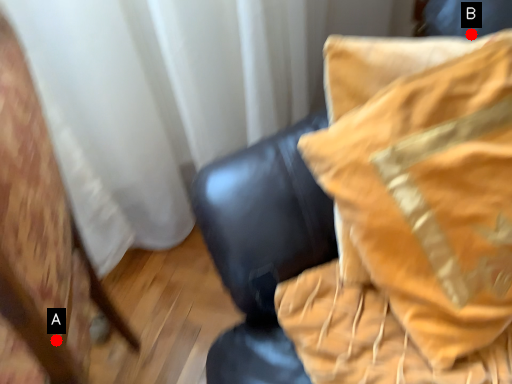
Question: Two points are circled on the image, labeled by A and B beside each circle. Which point appears farthest from the camera in this image?

Choices:
 (A) A is further
 (B) B is further

Answer: (B)